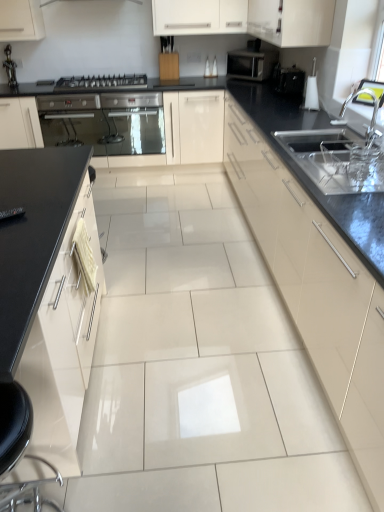
Question: Is matte black microwave at upper right to the left of black glossy toaster at upper right from the viewer's perspective?

Choices:
 (A) no
 (B) yes

Answer: (B)

Question: Is matte black microwave at upper right facing away from black glossy toaster at upper right?

Choices:
 (A) yes
 (B) no

Answer: (B)

Question: Does matte black microwave at upper right have a lesser width compared to black glossy toaster at upper right?

Choices:
 (A) no
 (B) yes

Answer: (A)

Question: From the image's perspective, is matte black microwave at upper right above black glossy toaster at upper right?

Choices:
 (A) yes
 (B) no

Answer: (A)

Question: Does matte black microwave at upper right have a lesser height compared to black glossy toaster at upper right?

Choices:
 (A) no
 (B) yes

Answer: (A)

Question: From a real-world perspective, relative to metallic stainless steel oven at left, is matte black microwave at upper right vertically above or below?

Choices:
 (A) above
 (B) below

Answer: (A)

Question: From the image's perspective, is matte black microwave at upper right above or below metallic stainless steel oven at left?

Choices:
 (A) above
 (B) below

Answer: (A)

Question: Considering the positions of matte black microwave at upper right and metallic stainless steel oven at left in the image, is matte black microwave at upper right taller or shorter than metallic stainless steel oven at left?

Choices:
 (A) tall
 (B) short

Answer: (B)

Question: Which is correct: matte black microwave at upper right is inside metallic stainless steel oven at left, or outside of it?

Choices:
 (A) inside
 (B) outside

Answer: (B)

Question: Is metallic silver gas stove at center-left to the left or to the right of silver metallic faucet at upper right in the image?

Choices:
 (A) left
 (B) right

Answer: (A)

Question: From a real-world perspective, is metallic silver gas stove at center-left positioned above or below silver metallic faucet at upper right?

Choices:
 (A) below
 (B) above

Answer: (A)

Question: In terms of width, does metallic silver gas stove at center-left look wider or thinner when compared to silver metallic faucet at upper right?

Choices:
 (A) thin
 (B) wide

Answer: (B)

Question: Relative to silver metallic faucet at upper right, is metallic silver gas stove at center-left in front or behind?

Choices:
 (A) behind
 (B) front

Answer: (A)

Question: From the image's perspective, is black glossy toaster at upper right above or below white glossy cabinet at upper center, which is the third cabinetry in right-to-left order?

Choices:
 (A) below
 (B) above

Answer: (A)

Question: In terms of height, does black glossy toaster at upper right look taller or shorter compared to white glossy cabinet at upper center, which is the third cabinetry in right-to-left order?

Choices:
 (A) short
 (B) tall

Answer: (A)